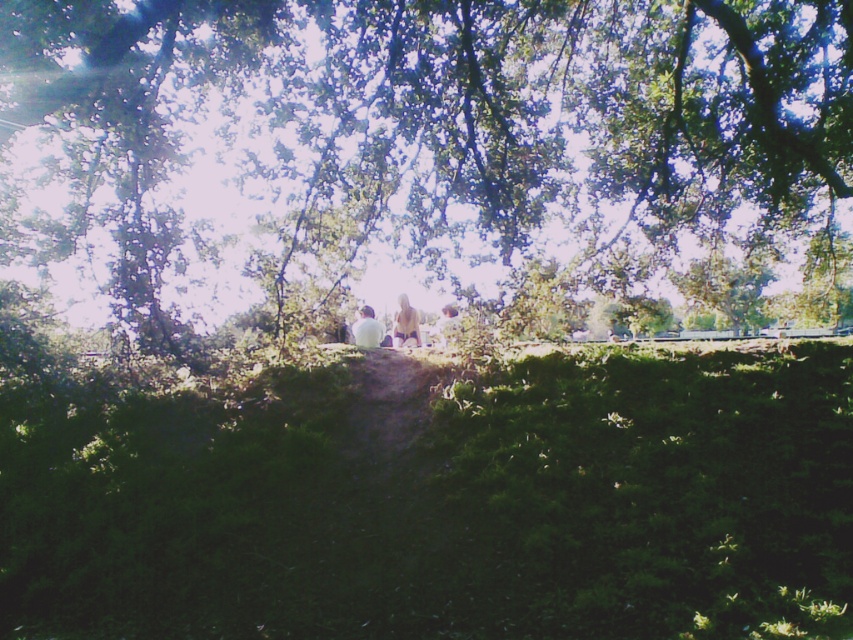
Who is positioned more to the right, green leafy tree at center or light brown fabric dress at center?

From the viewer's perspective, light brown fabric dress at center appears more on the right side.

Who is positioned more to the left, green leafy tree at center or light brown fabric dress at center?

green leafy tree at center is more to the left.

This screenshot has width=853, height=640. In order to click on green leafy tree at center in this screenshot , I will do `click(416, 134)`.

Is point (351, 328) more distant than point (459, 321)?

That is True.

From the picture: Which is more to the right, white matte shirt at center or light brown fabric person at center?

light brown fabric person at center is more to the right.

The image size is (853, 640). What do you see at coordinates (367, 330) in the screenshot?
I see `white matte shirt at center` at bounding box center [367, 330].

I want to click on white matte shirt at center, so click(x=367, y=330).

Consider the image. Does light brown fabric dress at center have a lesser width compared to white matte shirt at center?

Indeed, light brown fabric dress at center has a lesser width compared to white matte shirt at center.

Between point (402, 301) and point (363, 342), which one is positioned in front?

Positioned in front is point (402, 301).

Identify the location of light brown fabric dress at center. (405, 323).